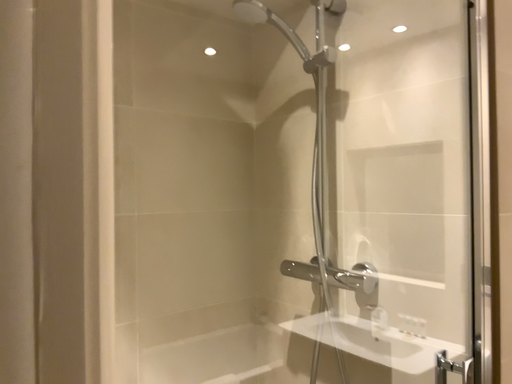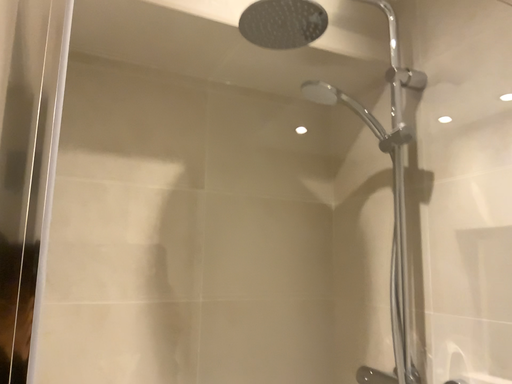
Question: Which way did the camera rotate in the video?

Choices:
 (A) rotated left
 (B) rotated right

Answer: (A)